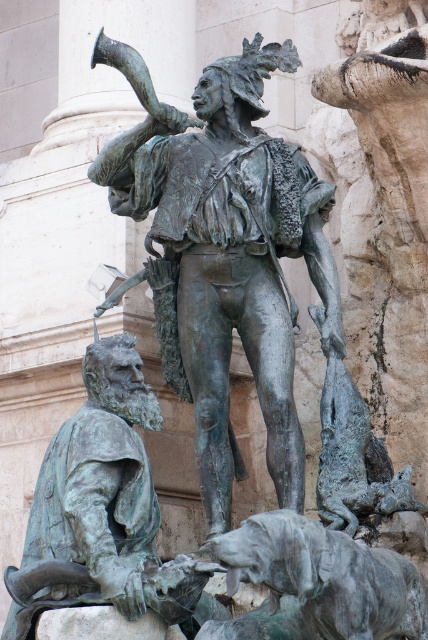
Question: From the image, what is the correct spatial relationship of bronze statue at center in relation to greenish patina dog at lower center?

Choices:
 (A) below
 (B) above

Answer: (B)

Question: Can you confirm if bronze statue at center is thinner than greenish patina dog at lower center?

Choices:
 (A) yes
 (B) no

Answer: (B)

Question: Which point is closer to the camera?

Choices:
 (A) click(x=321, y=534)
 (B) click(x=217, y=177)

Answer: (A)

Question: Where is bronze statue at center located in relation to greenish patina dog at lower center in the image?

Choices:
 (A) below
 (B) above

Answer: (B)

Question: Among these objects, which one is nearest to the camera?

Choices:
 (A) greenish patina dog at lower center
 (B) bronze statue at center

Answer: (A)